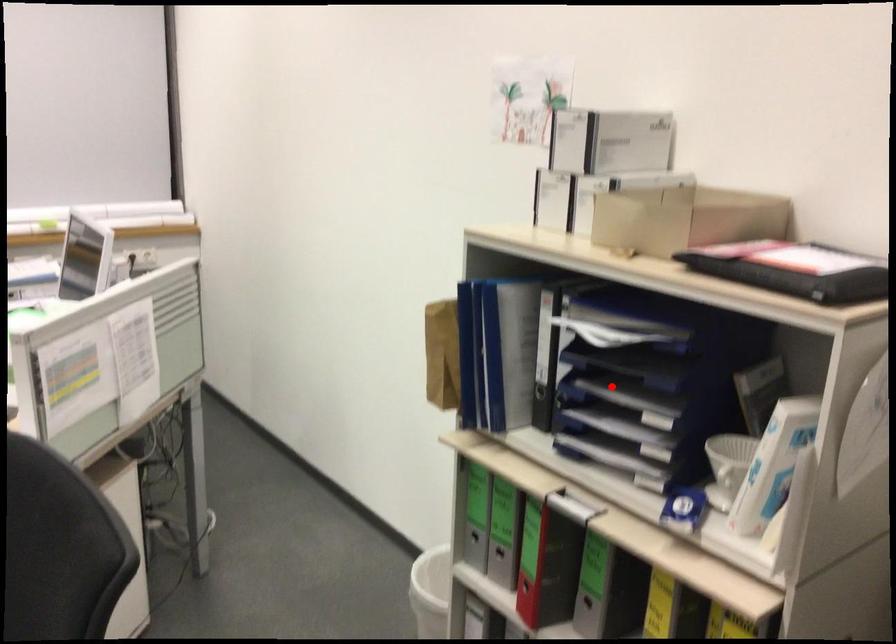
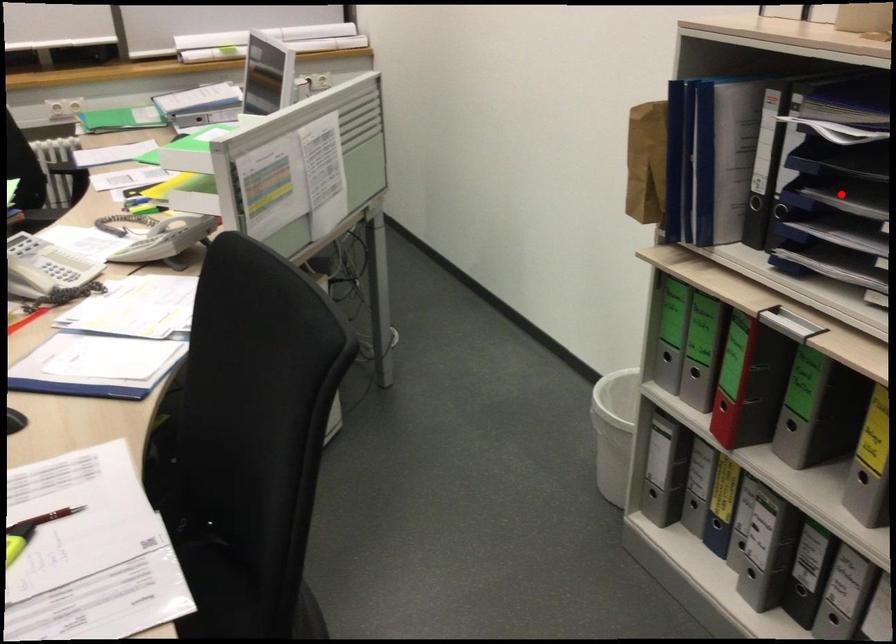
I am providing you with two images of the same scene from different viewpoints. A red point is marked on the first image and another point is marked on the second image. Do the highlighted points in image1 and image2 indicate the same real-world spot?

Yes